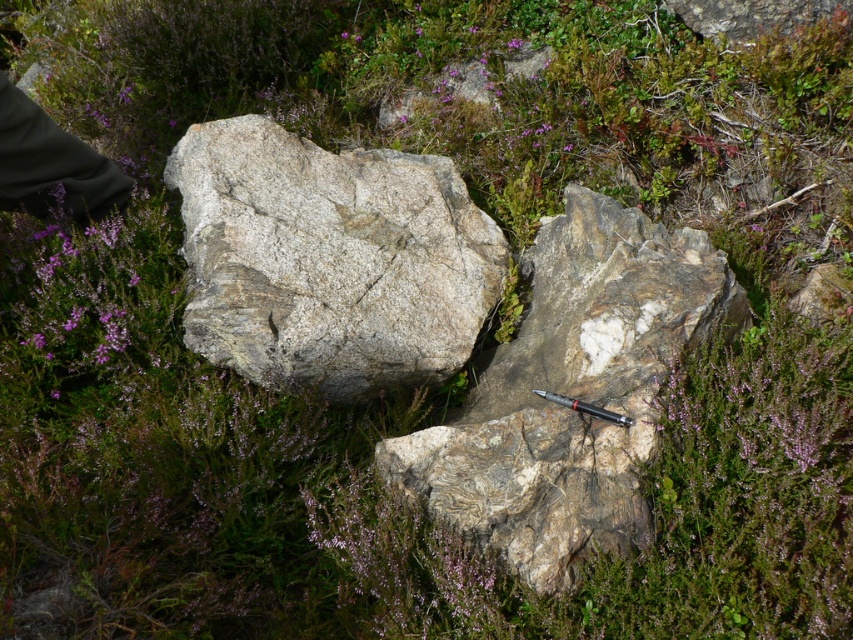
Question: Which of these objects is positioned closest to the granite rock at center?

Choices:
 (A) gray granite boulder at center
 (B) black fabric glove at upper left
 (C) black metallic pen at center

Answer: (C)

Question: Where is granite rock at center located in relation to black fabric glove at upper left in the image?

Choices:
 (A) left
 (B) right

Answer: (B)

Question: Which object is the closest to the gray granite boulder at center?

Choices:
 (A) black metallic pen at center
 (B) granite rock at center
 (C) black fabric glove at upper left

Answer: (B)

Question: Estimate the real-world distances between objects in this image. Which object is farther from the black fabric glove at upper left?

Choices:
 (A) granite rock at center
 (B) gray granite boulder at center
 (C) black metallic pen at center

Answer: (C)

Question: Does granite rock at center appear over black metallic pen at center?

Choices:
 (A) yes
 (B) no

Answer: (A)

Question: Does black fabric glove at upper left appear under black metallic pen at center?

Choices:
 (A) yes
 (B) no

Answer: (B)